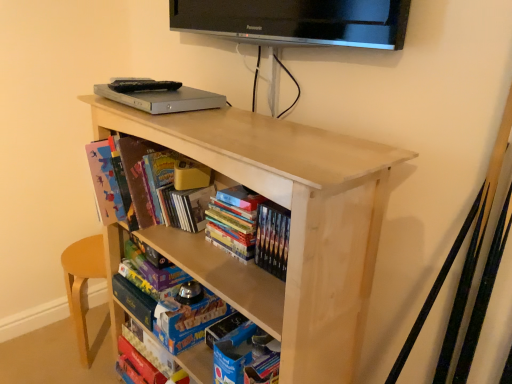
Find the location of `matte cardboard book at upper left, the 4th book in the bottom-to-top sequence`. matte cardboard book at upper left, the 4th book in the bottom-to-top sequence is located at coordinates (130, 179).

Find the location of a particular element. The image size is (512, 384). hardcover books at center, which is the second book from bottom to top is located at coordinates pos(250,228).

The image size is (512, 384). I want to click on matte cardboard book at upper left, the first book when ordered from top to bottom, so click(130, 179).

Consider the image. Is natural wood shelf at center not close to blue cardboard book at lower center?

No, natural wood shelf at center is in close proximity to blue cardboard book at lower center.

From a real-world perspective, is natural wood shelf at center located higher than blue cardboard book at lower center?

Yes.

Does point (367, 291) lie in front of point (169, 305)?

That is True.

Which object is closer to the camera, natural wood shelf at center or blue cardboard book at lower center?

natural wood shelf at center is closer to the camera.

From the matte cardboard book at lower center, the 1th book positioned from the bottom, count 3rd book to the right and point to it. Please provide its 2D coordinates.

[(250, 228)]

Which is farther from the camera, (165,349) or (207,225)?

The point (165,349) is farther from the camera.

Consider the image. Measure the distance from matte cardboard book at lower center, which is the fourth book in top-to-bottom order, to hardcover books at center, arranged as the third book when viewed from the top.

matte cardboard book at lower center, which is the fourth book in top-to-bottom order, is 22.33 inches away from hardcover books at center, arranged as the third book when viewed from the top.

From the image's perspective, who appears lower, hardcover books at center, arranged as the third book when viewed from the top, or hardcover book at center, acting as the 3th book starting from the bottom?

From the image's view, hardcover books at center, arranged as the third book when viewed from the top, is below.

You are a GUI agent. You are given a task and a screenshot of the screen. Output one action in this format:
    pyautogui.click(x=<x>, y=<y>)
    Task: Click on the book that is the 1st object located above the hardcover books at center, which is the second book from bottom to top (from the image's perspective)
    
    Given the screenshot: What is the action you would take?
    pyautogui.click(x=185, y=207)

Who is bigger, hardcover books at center, which is the second book from bottom to top, or hardcover book at center, the second book positioned from the top?

With larger size is hardcover book at center, the second book positioned from the top.

From a real-world perspective, which object stands above the other?

natural wood shelf at center, from a real-world perspective.

Is natural wood shelf at center next to matte cardboard book at lower center, which is the fourth book in top-to-bottom order, and touching it?

natural wood shelf at center and matte cardboard book at lower center, which is the fourth book in top-to-bottom order, are clearly separated.

How many degrees apart are the facing directions of natural wood shelf at center and matte cardboard book at lower center, the 1th book positioned from the bottom?

They differ by 0.804 degrees in their facing directions.

Is the depth of natural wood shelf at center less than that of matte cardboard book at lower center, the 1th book positioned from the bottom?

Yes, natural wood shelf at center is in front of matte cardboard book at lower center, the 1th book positioned from the bottom.

Which is behind, point (128, 326) or point (183, 310)?

The point (128, 326) is farther.

From the image's perspective, is matte cardboard book at lower center, which is the fourth book in top-to-bottom order, above or below blue cardboard book at lower center?

Based on their image positions, matte cardboard book at lower center, which is the fourth book in top-to-bottom order, is located beneath blue cardboard book at lower center.

Which of these two, matte cardboard book at lower center, the 1th book positioned from the bottom, or blue cardboard book at lower center, is wider?

blue cardboard book at lower center is wider.

Visually, is matte cardboard book at lower center, which is the fourth book in top-to-bottom order, positioned to the left or to the right of blue cardboard book at lower center?

Based on their positions, matte cardboard book at lower center, which is the fourth book in top-to-bottom order, is located to the left of blue cardboard book at lower center.

Can you confirm if hardcover books at center, arranged as the third book when viewed from the top, is shorter than matte cardboard book at lower center, which is the fourth book in top-to-bottom order?

No, hardcover books at center, arranged as the third book when viewed from the top, is not shorter than matte cardboard book at lower center, which is the fourth book in top-to-bottom order.

Is hardcover books at center, arranged as the third book when viewed from the top, at the right side of matte cardboard book at lower center, which is the fourth book in top-to-bottom order?

Indeed, hardcover books at center, arranged as the third book when viewed from the top, is positioned on the right side of matte cardboard book at lower center, which is the fourth book in top-to-bottom order.

Which of these two, hardcover books at center, arranged as the third book when viewed from the top, or matte cardboard book at lower center, which is the fourth book in top-to-bottom order, is wider?

Wider between the two is matte cardboard book at lower center, which is the fourth book in top-to-bottom order.

Which of these two, hardcover books at center, which is the second book from bottom to top, or matte cardboard book at lower center, the 1th book positioned from the bottom, is smaller?

matte cardboard book at lower center, the 1th book positioned from the bottom.

Where is `book that is the 1st object located below the hardcover book at center, acting as the 3th book starting from the bottom (from the image's perspective)`? The image size is (512, 384). book that is the 1st object located below the hardcover book at center, acting as the 3th book starting from the bottom (from the image's perspective) is located at coordinates point(250,228).

I want to click on paperback book below the natural wood shelf at center (from the image's perspective), so click(x=187, y=321).

Which book is the 3rd one when counting from the left side of the hardcover books at center, which is the second book from bottom to top? Please provide its 2D coordinates.

[(153, 356)]

Which object lies nearer to the anchor point matte cardboard book at lower center, the 1th book positioned from the bottom, hardcover book at center, the second book positioned from the top, or natural wood shelf at center?

The object closer to matte cardboard book at lower center, the 1th book positioned from the bottom, is hardcover book at center, the second book positioned from the top.

Based on their spatial positions, is matte cardboard book at lower center, which is the fourth book in top-to-bottom order, or matte cardboard book at upper left, the first book when ordered from top to bottom, further from natural wood shelf at center?

matte cardboard book at lower center, which is the fourth book in top-to-bottom order, lies further to natural wood shelf at center than the other object.

Which object lies further to the anchor point hardcover books at center, which is the second book from bottom to top, natural wood shelf at center or matte cardboard book at lower center, which is the fourth book in top-to-bottom order?

matte cardboard book at lower center, which is the fourth book in top-to-bottom order.

Based on their spatial positions, is matte cardboard book at lower center, the 1th book positioned from the bottom, or natural wood shelf at center closer to blue cardboard book at lower center?

matte cardboard book at lower center, the 1th book positioned from the bottom, is closer to blue cardboard book at lower center.

From the image, which object appears to be farther from matte cardboard book at lower center, the 1th book positioned from the bottom, matte cardboard book at upper left, the 4th book in the bottom-to-top sequence, or hardcover books at center, arranged as the third book when viewed from the top?

hardcover books at center, arranged as the third book when viewed from the top.

In the scene shown: When comparing their distances from hardcover book at center, acting as the 3th book starting from the bottom, does natural wood shelf at center or matte cardboard book at upper left, the first book when ordered from top to bottom, seem further?

The object further to hardcover book at center, acting as the 3th book starting from the bottom, is natural wood shelf at center.

Estimate the real-world distances between objects in this image. Which object is further from hardcover books at center, arranged as the third book when viewed from the top, matte cardboard book at lower center, which is the fourth book in top-to-bottom order, or hardcover book at center, the second book positioned from the top?

matte cardboard book at lower center, which is the fourth book in top-to-bottom order, is positioned further to the anchor hardcover books at center, arranged as the third book when viewed from the top.

Looking at the image, which one is located further to matte cardboard book at upper left, the 4th book in the bottom-to-top sequence, hardcover books at center, which is the second book from bottom to top, or blue cardboard book at lower center?

blue cardboard book at lower center lies further to matte cardboard book at upper left, the 4th book in the bottom-to-top sequence, than the other object.

Locate an element on the screen. The image size is (512, 384). book located between matte cardboard book at upper left, the 4th book in the bottom-to-top sequence, and hardcover books at center, arranged as the third book when viewed from the top, in the left-right direction is located at coordinates (185, 207).

Find the location of a particular element. The image size is (512, 384). paperback book that lies between hardcover books at center, arranged as the third book when viewed from the top, and matte cardboard book at lower center, which is the fourth book in top-to-bottom order, from top to bottom is located at coordinates (187, 321).

Find the location of a particular element. The image size is (512, 384). paperback book that lies between matte cardboard book at upper left, the first book when ordered from top to bottom, and matte cardboard book at lower center, the 1th book positioned from the bottom, from top to bottom is located at coordinates (187, 321).

Find the location of a particular element. book between natural wood shelf at center and matte cardboard book at upper left, the first book when ordered from top to bottom, along the z-axis is located at coordinates (250, 228).